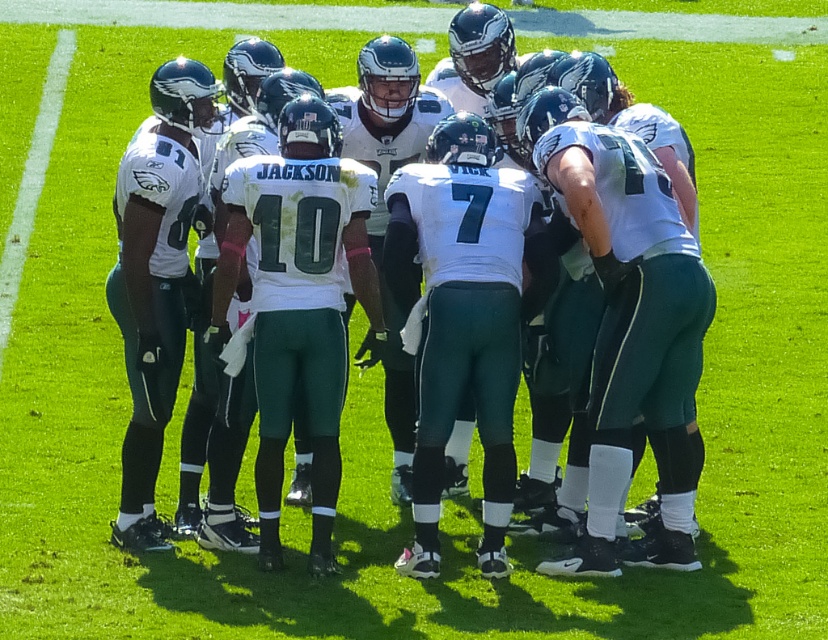
You are standing on the field and see the point marked at coordinates (x=595, y=301). What object is located at that point?

The white jersey at center is located at point (x=595, y=301).